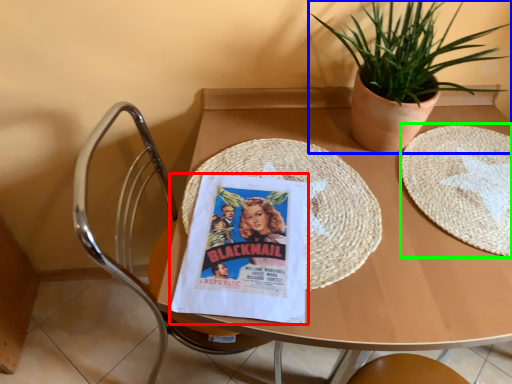
Question: Which object is the farthest from comic book (highlighted by a red box)? Choose among these: houseplant (highlighted by a blue box) or paper plate (highlighted by a green box).

Choices:
 (A) houseplant
 (B) paper plate

Answer: (A)